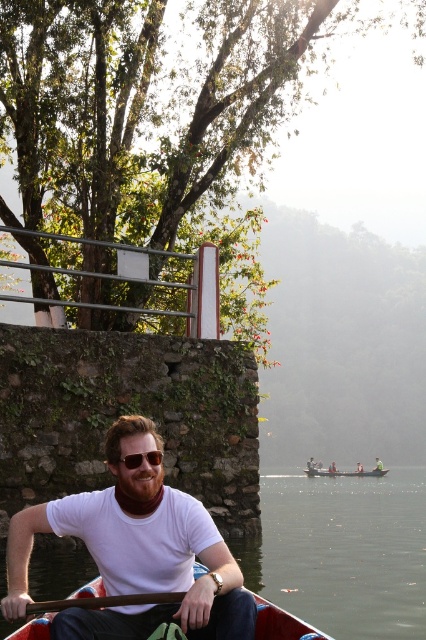
Who is taller, white matte t-shirt at center or brown wooden paddle at lower center?

white matte t-shirt at center is taller.

Between white matte t-shirt at center and brown wooden paddle at lower center, which one appears on the left side from the viewer's perspective?

From the viewer's perspective, white matte t-shirt at center appears more on the left side.

Does point (74, 520) come in front of point (34, 605)?

No, (74, 520) is further to viewer.

Where is `white matte t-shirt at center`? white matte t-shirt at center is located at coordinates point(137,552).

Is wooden canoe at center below sunglasses at center?

Yes, wooden canoe at center is below sunglasses at center.

Is wooden canoe at center further to camera compared to sunglasses at center?

Yes.

Consider the image. Who is more distant from viewer, (379, 472) or (137, 465)?

Point (379, 472)

Image resolution: width=426 pixels, height=640 pixels. I want to click on wooden canoe at center, so click(x=345, y=472).

From the picture: Is white matte t-shirt at center taller than wooden canoe at center?

Yes.

Based on the photo, which is above, white matte t-shirt at center or wooden canoe at center?

Positioned higher is white matte t-shirt at center.

Which is in front, point (106, 620) or point (365, 476)?

Positioned in front is point (106, 620).

Where is `white matte t-shirt at center`? white matte t-shirt at center is located at coordinates (137, 552).